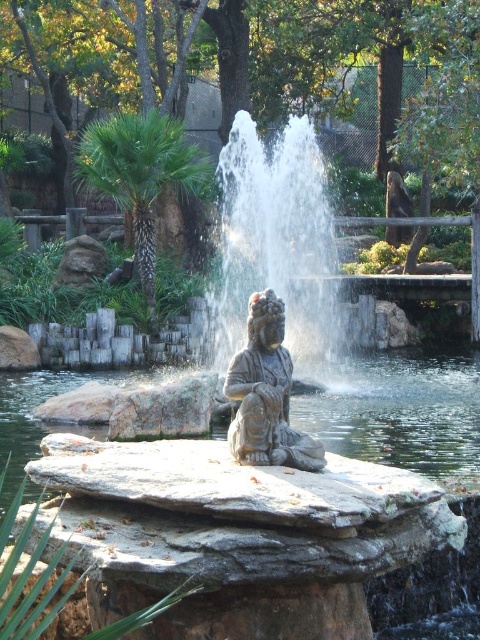
Question: Is slate gray stone fountain at center positioned at the back of matte stone statue at center?

Choices:
 (A) no
 (B) yes

Answer: (B)

Question: Does gray stone water at center appear on the left side of slate gray stone fountain at center?

Choices:
 (A) no
 (B) yes

Answer: (B)

Question: Among these points, which one is nearest to the camera?

Choices:
 (A) (251, 300)
 (B) (333, 394)
 (C) (232, 344)

Answer: (A)

Question: Estimate the real-world distances between objects in this image. Which object is closer to the matte stone statue at center?

Choices:
 (A) slate gray stone fountain at center
 (B) gray stone water at center

Answer: (B)

Question: Which object appears farthest from the camera in this image?

Choices:
 (A) gray stone water at center
 (B) matte stone statue at center
 (C) slate gray stone fountain at center

Answer: (A)

Question: Observing the image, what is the correct spatial positioning of slate gray stone fountain at center in reference to matte stone statue at center?

Choices:
 (A) left
 (B) right

Answer: (B)